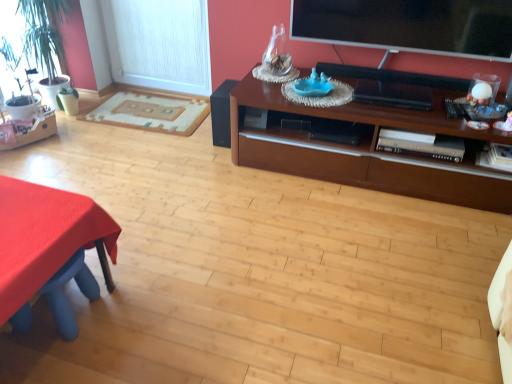
Question: Is flat screen tv at upper right completely or partially inside red fabric table at lower left?

Choices:
 (A) no
 (B) yes

Answer: (A)

Question: Is the position of red fabric table at lower left less distant than that of flat screen tv at upper right?

Choices:
 (A) no
 (B) yes

Answer: (B)

Question: Can you confirm if red fabric table at lower left is wider than flat screen tv at upper right?

Choices:
 (A) yes
 (B) no

Answer: (A)

Question: Can you confirm if red fabric table at lower left is thinner than flat screen tv at upper right?

Choices:
 (A) yes
 (B) no

Answer: (B)

Question: Is red fabric table at lower left taller than flat screen tv at upper right?

Choices:
 (A) yes
 (B) no

Answer: (A)

Question: Is red fabric table at lower left smaller than flat screen tv at upper right?

Choices:
 (A) no
 (B) yes

Answer: (A)

Question: Is white textured window screen at left far away from brown wood cabinet at upper right?

Choices:
 (A) yes
 (B) no

Answer: (A)

Question: From the image's perspective, is white textured window screen at left below brown wood cabinet at upper right?

Choices:
 (A) yes
 (B) no

Answer: (B)

Question: Is brown wood cabinet at upper right completely or partially inside white textured window screen at left?

Choices:
 (A) no
 (B) yes

Answer: (A)

Question: From a real-world perspective, is white textured window screen at left beneath brown wood cabinet at upper right?

Choices:
 (A) no
 (B) yes

Answer: (A)

Question: Is white textured window screen at left taller than brown wood cabinet at upper right?

Choices:
 (A) yes
 (B) no

Answer: (A)

Question: Is white textured window screen at left positioned with its back to brown wood cabinet at upper right?

Choices:
 (A) yes
 (B) no

Answer: (B)

Question: Does beige woven rug at left have a greater height compared to white textured window screen at left?

Choices:
 (A) no
 (B) yes

Answer: (A)